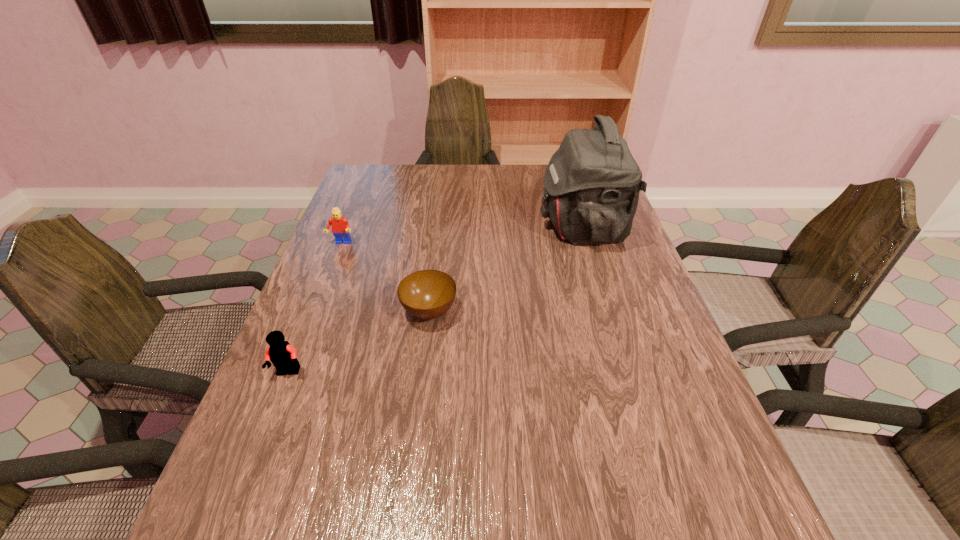
Identify the location of vacant position located on the front-facing side of the farther Lego. [299, 352].

The width and height of the screenshot is (960, 540). In order to click on free space located 0.060m on the back of the third farthest object in this screenshot , I will do `click(434, 277)`.

This screenshot has height=540, width=960. Find the location of `object positioned at the right edge`. object positioned at the right edge is located at coordinates (592, 182).

This screenshot has height=540, width=960. I want to click on vacant region at the far edge of the desktop, so click(x=434, y=165).

Image resolution: width=960 pixels, height=540 pixels. I want to click on vacant space at the near edge of the desktop, so click(x=396, y=537).

Locate an element on the screen. vacant space at the left edge of the desktop is located at coordinates (375, 240).

This screenshot has height=540, width=960. Find the location of `free region at the right edge of the desktop`. free region at the right edge of the desktop is located at coordinates (587, 262).

The image size is (960, 540). Find the location of `free location at the far left corner of the desktop`. free location at the far left corner of the desktop is located at coordinates (371, 169).

This screenshot has width=960, height=540. In order to click on free point between the farther Lego and the shoulder bag in this screenshot , I will do `click(462, 235)`.

At what (x,y) coordinates should I click in order to perform the action: click on vacant space that is in between the rightmost object and the shortest object. Please return your answer as a coordinate pair (x, y). The image size is (960, 540). Looking at the image, I should click on (506, 269).